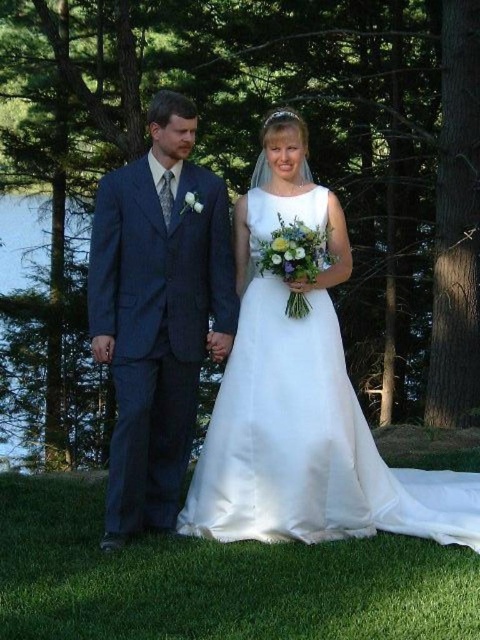
You are a photographer setting up for a wedding photo shoot. The bride is wearing a white satin dress at center. To ensure the dress is perfectly centered in the frame, where should you position your camera? Please provide coordinates based on the image grid system where the bottom left corner is the origin point.

The white satin dress at center is positioned at point coordinates of (x=308, y=444). Therefore, the photographer should aim the camera to center the dress at those coordinates.

Looking at this image, you are a photographer standing at a certain distance from the white satin dress at center. You need to capture a full body shot of the dress without any distortion. The recommended distance for such shots is between 3 to 5 meters. Is your current position suitable?

The distance between you and the white satin dress at center is 4.09 meters, which falls within the recommended 3 to 5 meters range. Therefore, your current position is suitable for capturing a full body shot without distortion.